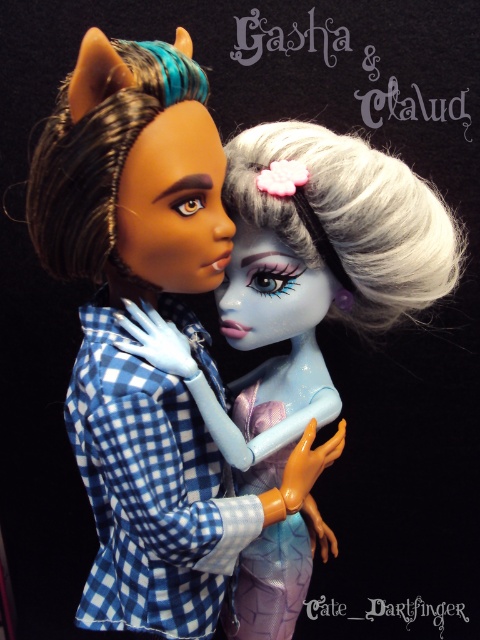
You are standing in front of the dolls and want to place a small decoration exactly at point (213, 564). If your hand is 36 inches away from the point, can you reach it?

The point (213, 564) is 37.20 inches away from the viewer. Since your hand is only 36 inches away, you cannot reach it.

You are an artist trying to sketch the scene. You want to ensure the shiny blue hair at center and the matte blue checkered shirt at center are proportionally accurate. Which object should you draw first to establish the correct height relationship between them?

The shiny blue hair at center should be drawn first because it is much taller than the matte blue checkered shirt at center, so starting with the taller object ensures proper scaling and positioning for the other.

You are a collector of miniature dolls and want to place a tiny decorative pin between the shiny blue hair at center and the matte blue checkered shirt at center. What is the minimum distance the pin must be able to span to fit between them?

The shiny blue hair at center and matte blue checkered shirt at center are 10.81 centimeters apart from each other. Therefore, the pin must be at least 10.81 centimeters long to fit between them.